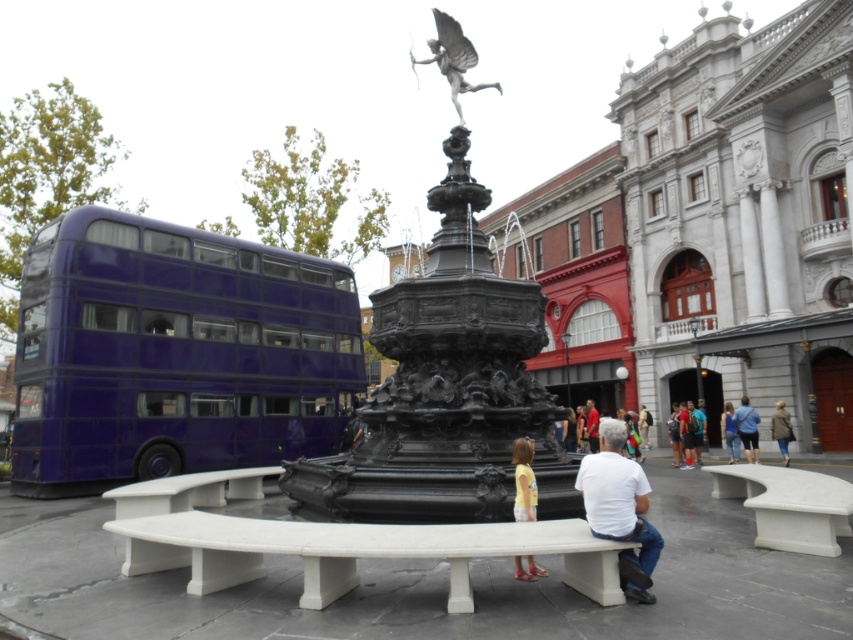
Question: Which is farther from the white stone bench at center?

Choices:
 (A) yellow cotton shirt at lower center
 (B) blue jeans at lower center
 (C) dark gray wool coat at lower right

Answer: (B)

Question: Is metallic purple bus at left smaller than white stone bench at center?

Choices:
 (A) no
 (B) yes

Answer: (A)

Question: Is yellow cotton shirt at lower center below denim jacket at lower right?

Choices:
 (A) yes
 (B) no

Answer: (B)

Question: Which point appears farthest from the camera in this image?

Choices:
 (A) (787, 435)
 (B) (779, 467)

Answer: (A)

Question: Can you confirm if white cotton shirt at center is positioned above blue jeans at lower center?

Choices:
 (A) yes
 (B) no

Answer: (A)

Question: Which of the following is the closest to the observer?

Choices:
 (A) dark gray wool coat at lower right
 (B) denim jacket at lower right

Answer: (B)